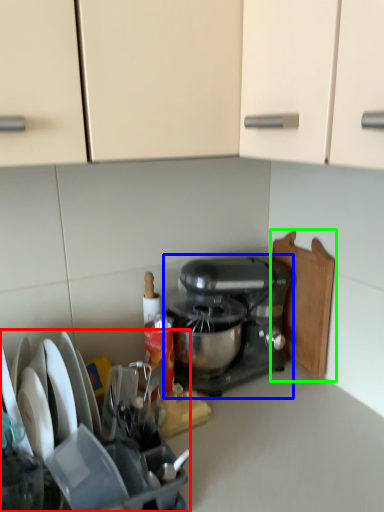
Question: Based on their relative distances, which object is farther from appliance (highlighted by a red box)? Choose from mixer (highlighted by a blue box) and cutting board (highlighted by a green box).

Choices:
 (A) mixer
 (B) cutting board

Answer: (B)